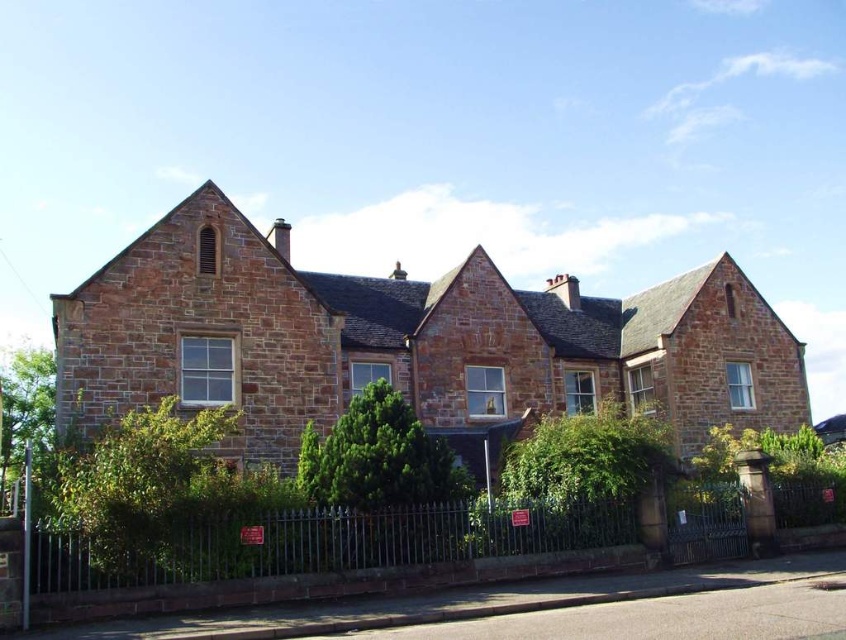
Can you confirm if green wrought iron fence at lower center is positioned above green leafy hedge at center?

Actually, green wrought iron fence at lower center is below green leafy hedge at center.

Does green wrought iron fence at lower center have a greater width compared to green leafy hedge at center?

Indeed, green wrought iron fence at lower center has a greater width compared to green leafy hedge at center.

Where is `green wrought iron fence at lower center`? The height and width of the screenshot is (640, 846). green wrought iron fence at lower center is located at coordinates (344, 557).

Can you confirm if green leafy hedge at center is taller than green leafy hedge at lower right?

Yes.

Looking at this image, can you confirm if green leafy hedge at center is wider than green leafy hedge at lower right?

No, green leafy hedge at center is not wider than green leafy hedge at lower right.

Between point (350, 497) and point (603, 413), which one is positioned behind?

The point (603, 413) is behind.

Find the location of a particular element. The height and width of the screenshot is (640, 846). green leafy hedge at center is located at coordinates (380, 486).

Is green leafy hedge at lower left closer to camera compared to green leafy hedge at center?

Yes, green leafy hedge at lower left is closer to the viewer.

Between point (161, 490) and point (349, 486), which one is positioned behind?

The point (349, 486) is more distant.

In order to click on green leafy hedge at lower left in this screenshot , I will do `click(135, 492)`.

Locate an element on the screen. This screenshot has width=846, height=640. green leafy hedge at lower left is located at coordinates (135, 492).